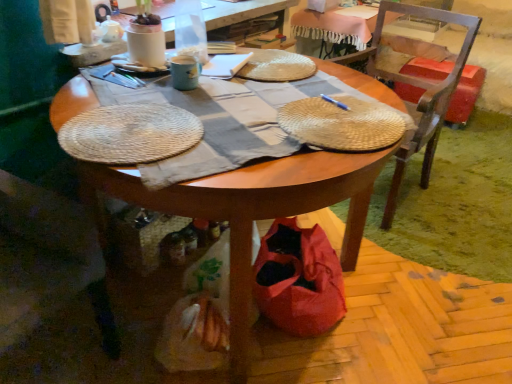
The width and height of the screenshot is (512, 384). I want to click on spots to the right of blue metallic pen at center, so click(377, 105).